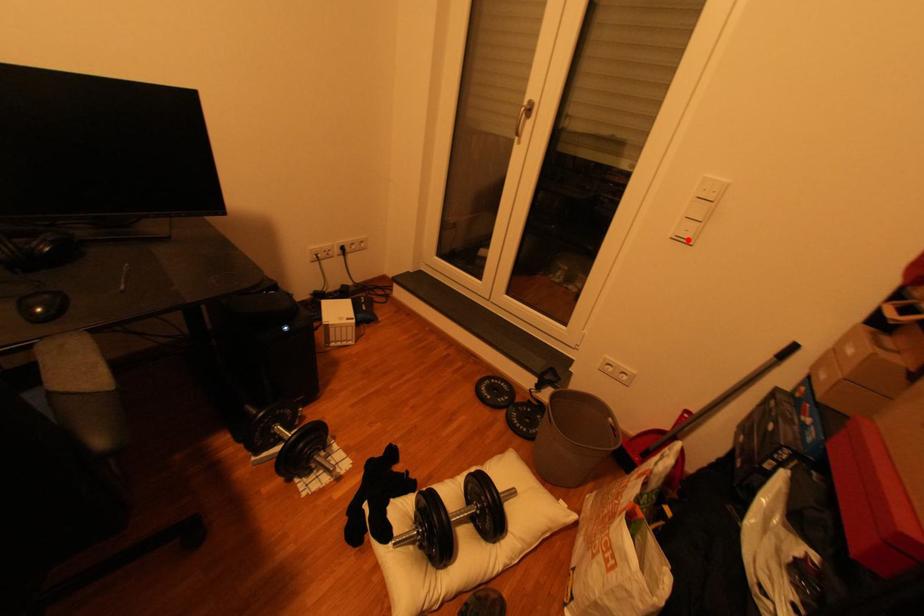
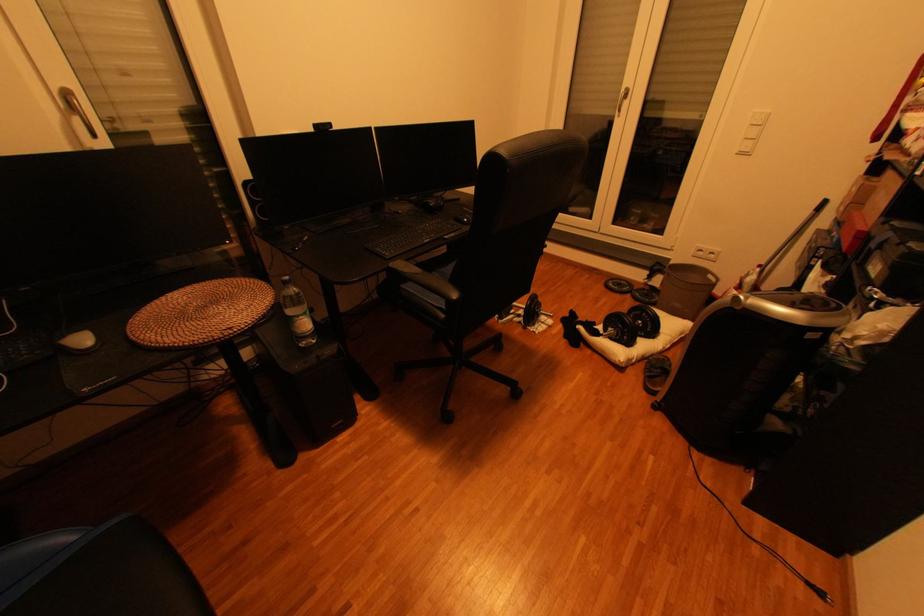
Where in the second image is the point corresponding to the highlighted location from the first image?

(749, 155)